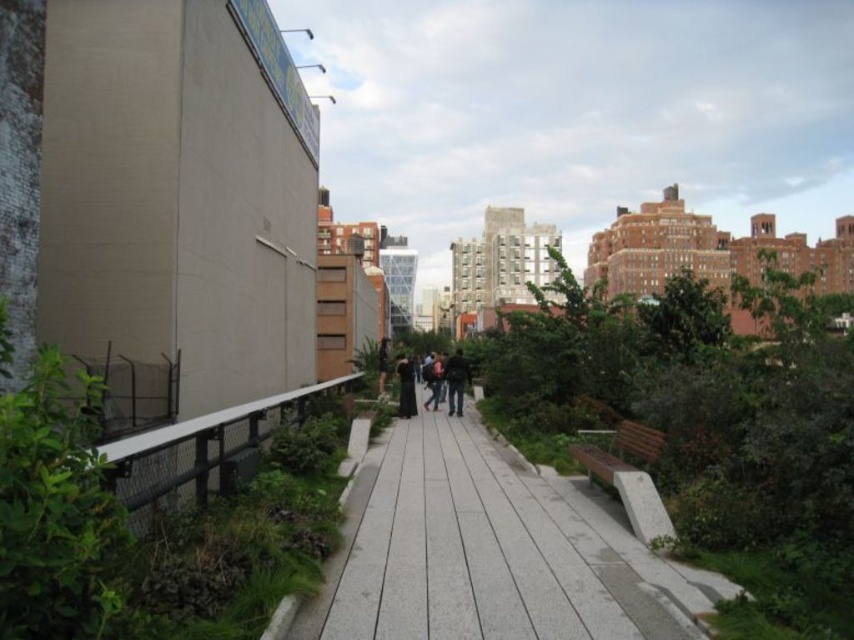
Question: Can you confirm if gray concrete pavement at center is positioned below dark gray jacket at center?

Choices:
 (A) no
 (B) yes

Answer: (B)

Question: Which point is farther from the camera taking this photo?

Choices:
 (A) (490, 588)
 (B) (431, 397)
 (C) (408, 372)
 (D) (468, 369)

Answer: (D)

Question: Can you confirm if dark gray jacket at center is smaller than dark gray backpack at center?

Choices:
 (A) no
 (B) yes

Answer: (A)

Question: Which point is farther from the camera taking this photo?

Choices:
 (A) 405,374
 (B) 459,404
 (C) 568,625

Answer: (A)

Question: Does dark gray jacket at center have a lesser width compared to black leather jacket at center?

Choices:
 (A) yes
 (B) no

Answer: (A)

Question: Which of the following is the closest to the observer?

Choices:
 (A) black leather jacket at center
 (B) dark gray backpack at center
 (C) gray concrete pavement at center

Answer: (C)